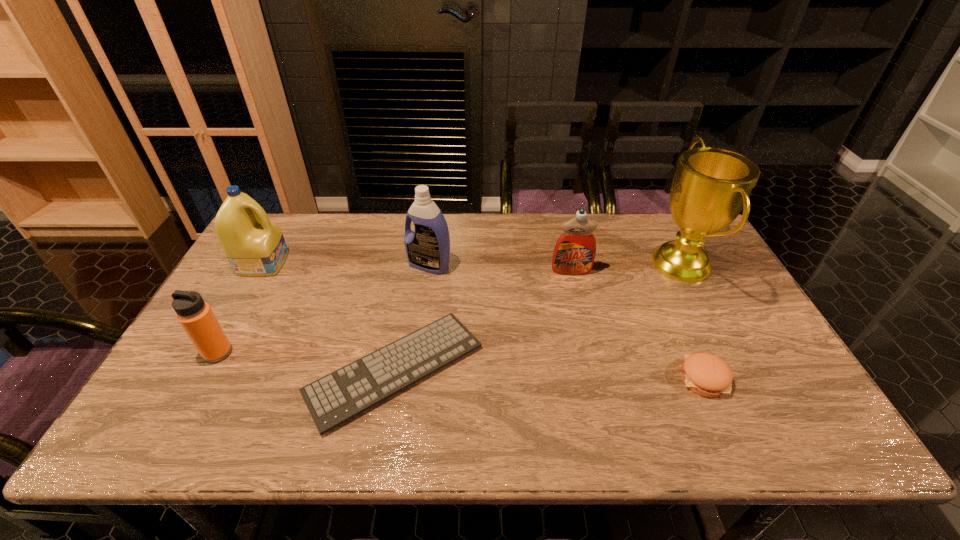
I want to click on thermos bottle positioned at the left edge, so click(x=196, y=317).

The height and width of the screenshot is (540, 960). In order to click on award situated at the right edge in this screenshot , I will do `click(711, 186)`.

This screenshot has width=960, height=540. I want to click on patty located in the right edge section of the desktop, so click(x=705, y=374).

Find the location of a particular element. object that is at the far left corner is located at coordinates point(255,247).

Find the location of `object present at the far right corner`. object present at the far right corner is located at coordinates (711, 186).

Find the location of a particular element. vacant point at the far edge is located at coordinates pos(561,226).

This screenshot has height=540, width=960. I want to click on free space at the near edge, so click(575, 427).

In the image, there is a desktop. What are the coordinates of `vacant space at the right edge` in the screenshot? It's located at (749, 327).

The width and height of the screenshot is (960, 540). In the image, there is a desktop. What are the coordinates of `vacant space at the far left corner` in the screenshot? It's located at (306, 221).

Where is `empty space between the shortest object and the second detergent from right to left`? The height and width of the screenshot is (540, 960). empty space between the shortest object and the second detergent from right to left is located at coordinates (412, 317).